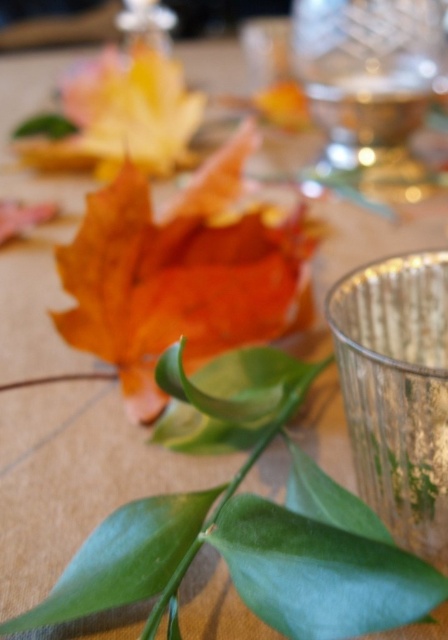
Question: Does orange matte leaf at center have a greater width compared to clear glass wine glass at upper right?

Choices:
 (A) no
 (B) yes

Answer: (B)

Question: Which of the following is the farthest from the observer?

Choices:
 (A) (373, 52)
 (B) (177, 276)

Answer: (A)

Question: Can you confirm if orange matte leaf at center is positioned below clear glass wine glass at upper right?

Choices:
 (A) yes
 (B) no

Answer: (A)

Question: Which object appears farthest from the camera in this image?

Choices:
 (A) orange matte leaf at center
 (B) clear glass wine glass at upper right

Answer: (B)

Question: Which point is farther to the camera?

Choices:
 (A) (x=201, y=257)
 (B) (x=395, y=56)

Answer: (B)

Question: Is orange matte leaf at center to the left of clear glass wine glass at upper right from the viewer's perspective?

Choices:
 (A) no
 (B) yes

Answer: (B)